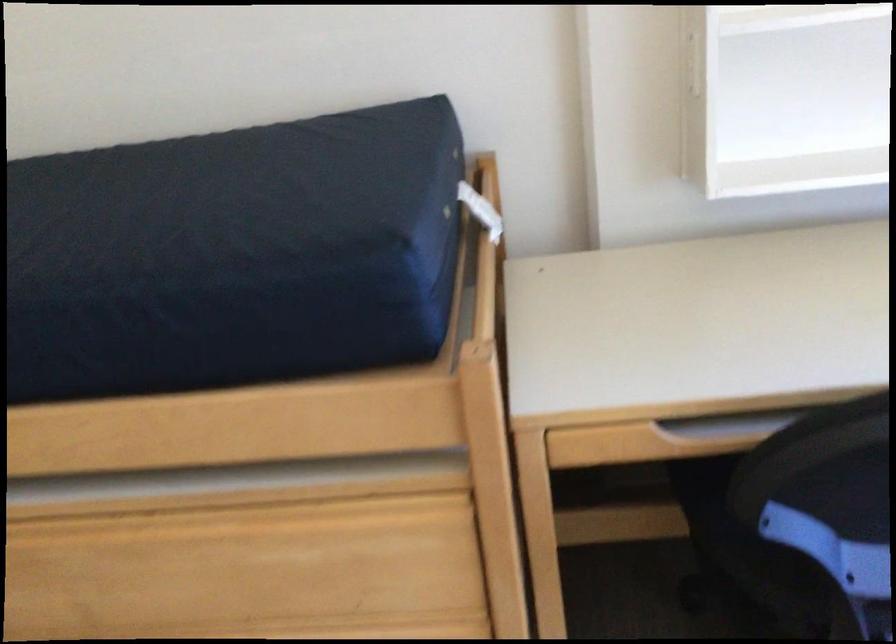
This screenshot has width=896, height=644. I want to click on white fabric tag, so click(480, 211).